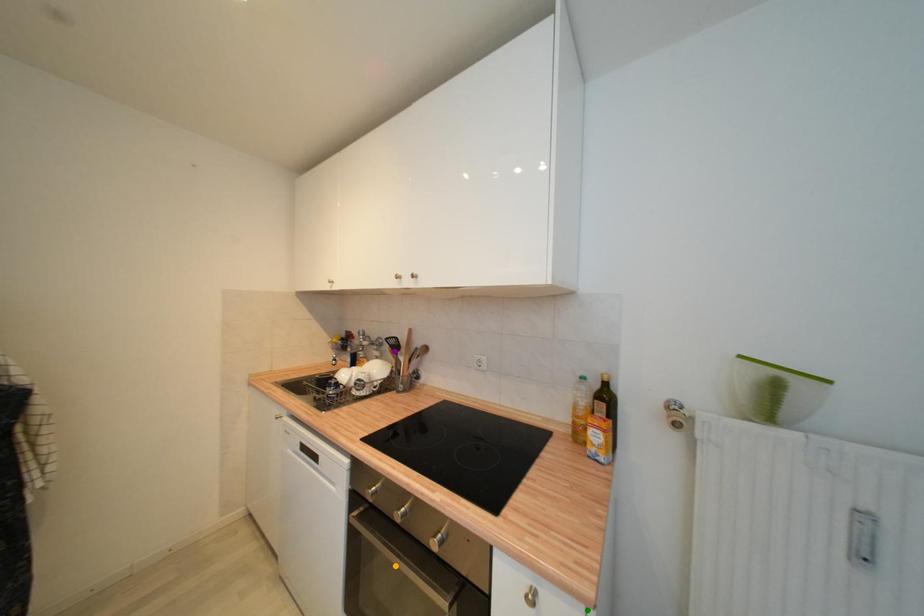
Order these from nearest to farthest:
- green point
- purple point
- orange point

green point, orange point, purple point